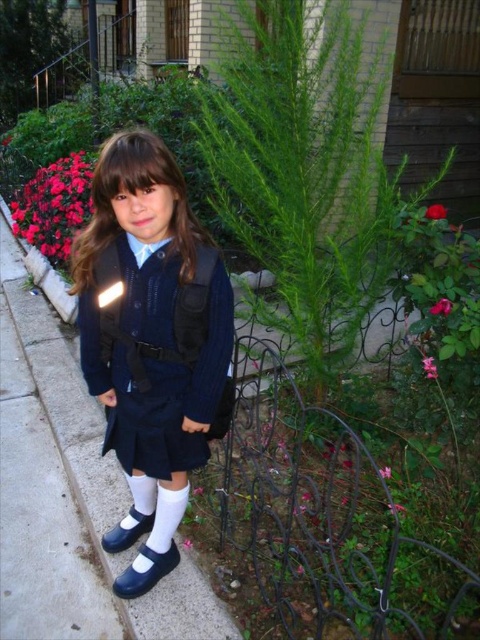
Between glossy rose at right and pink matte rose at center right, which one appears on the right side from the viewer's perspective?

From the viewer's perspective, glossy rose at right appears more on the right side.

Which of these two, glossy rose at right or pink matte rose at center right, stands taller?

With more height is pink matte rose at center right.

Is point (445, 310) less distant than point (402, 506)?

Yes, point (445, 310) is in front of point (402, 506).

You are a GUI agent. You are given a task and a screenshot of the screen. Output one action in this format:
    pyautogui.click(x=<x>, y=<y>)
    Task: Click on the glossy rose at right
    The width and height of the screenshot is (480, 640).
    Given the screenshot: What is the action you would take?
    click(x=442, y=307)

Is shiny black shoe at lower center to the right of pink matte rose at center right from the viewer's perspective?

Incorrect, shiny black shoe at lower center is not on the right side of pink matte rose at center right.

Can you confirm if shiny black shoe at lower center is positioned above pink matte rose at center right?

Incorrect, shiny black shoe at lower center is not positioned above pink matte rose at center right.

Does point (113, 582) come farther from viewer compared to point (392, 502)?

Yes, point (113, 582) is farther from viewer.

Where is `shiny black shoe at lower center`? shiny black shoe at lower center is located at coordinates (145, 570).

Between matte blue dress at center and matte blue shoe at lower left, which one appears on the left side from the viewer's perspective?

From the viewer's perspective, matte blue shoe at lower left appears more on the left side.

Consider the image. Does matte blue dress at center appear over matte blue shoe at lower left?

Yes, matte blue dress at center is above matte blue shoe at lower left.

Locate an element on the screen. matte blue dress at center is located at coordinates (151, 316).